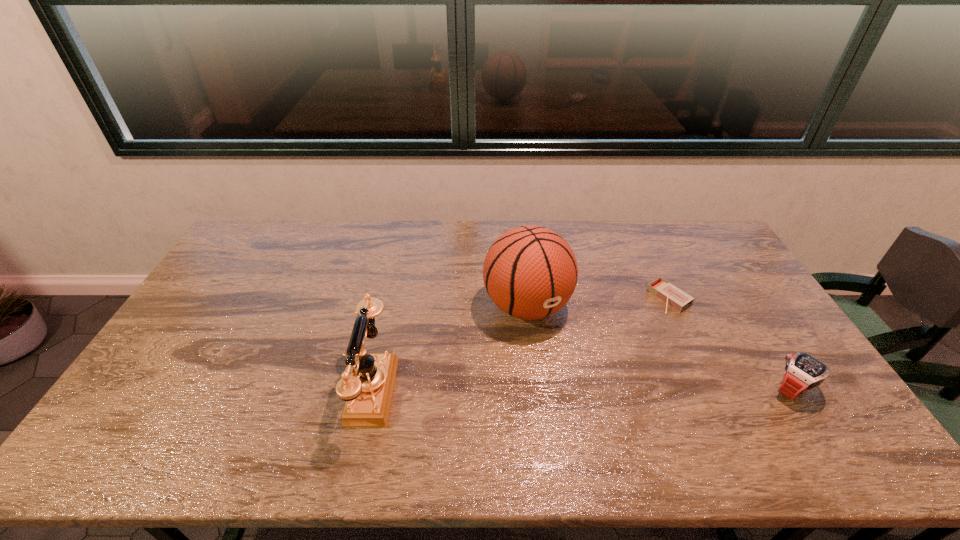
I want to click on vacant area that lies between the second object from right to left and the tallest object, so click(x=598, y=302).

Find the location of a particular element. The width and height of the screenshot is (960, 540). vacant point located between the rightmost object and the telephone is located at coordinates (580, 389).

This screenshot has height=540, width=960. Identify the location of vacant area that lies between the matchbox and the second tallest object. (518, 344).

The image size is (960, 540). I want to click on free spot between the basketball and the telephone, so click(447, 348).

At what (x,y) coordinates should I click in order to perform the action: click on vacant space in between the matchbox and the basketball. Please return your answer as a coordinate pair (x, y). The width and height of the screenshot is (960, 540). Looking at the image, I should click on (598, 302).

At what (x,y) coordinates should I click in order to perform the action: click on free space between the rightmost object and the telephone. Please return your answer as a coordinate pair (x, y). This screenshot has height=540, width=960. Looking at the image, I should click on (580, 389).

Find the location of `vacant region between the shortest object and the tallest object`. vacant region between the shortest object and the tallest object is located at coordinates (598, 302).

This screenshot has width=960, height=540. I want to click on free spot between the third object from left to right and the rightmost object, so click(731, 344).

Find the location of `object identified as the second closest to the leftmost object`. object identified as the second closest to the leftmost object is located at coordinates (662, 289).

Select which object appears as the second closest to the rightmost object. Please provide its 2D coordinates. Your answer should be formatted as a tuple, i.e. [(x, y)], where the tuple contains the x and y coordinates of a point satisfying the conditions above.

[(530, 272)]